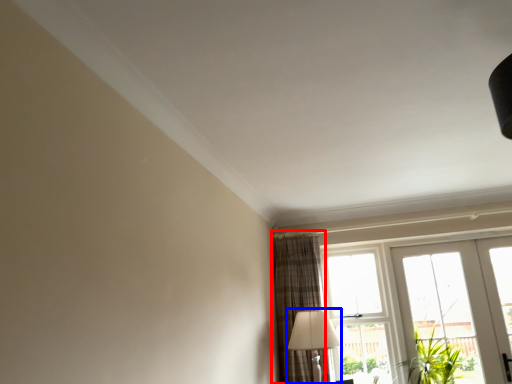
Question: Which object is further to the camera taking this photo, curtain (highlighted by a red box) or table lamp (highlighted by a blue box)?

Choices:
 (A) curtain
 (B) table lamp

Answer: (A)